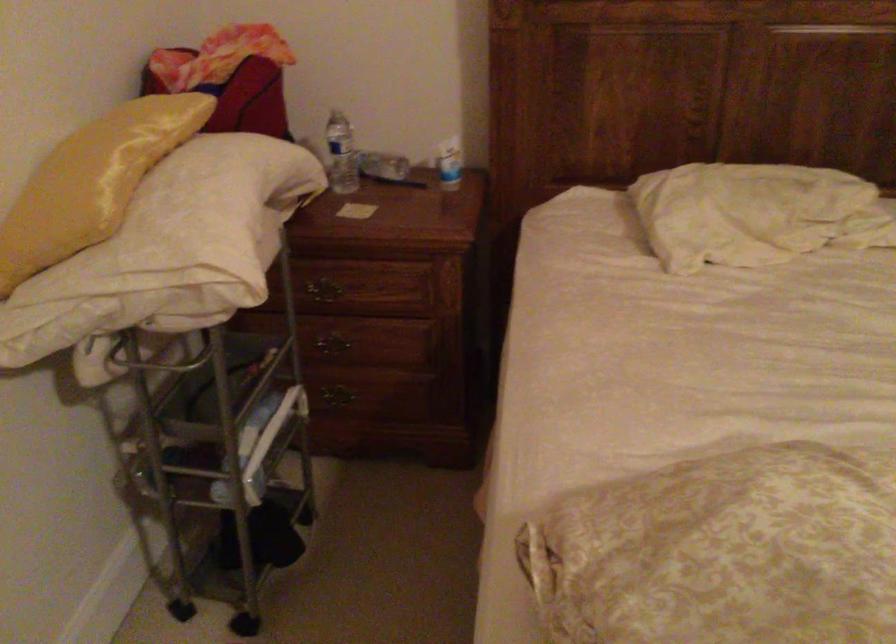
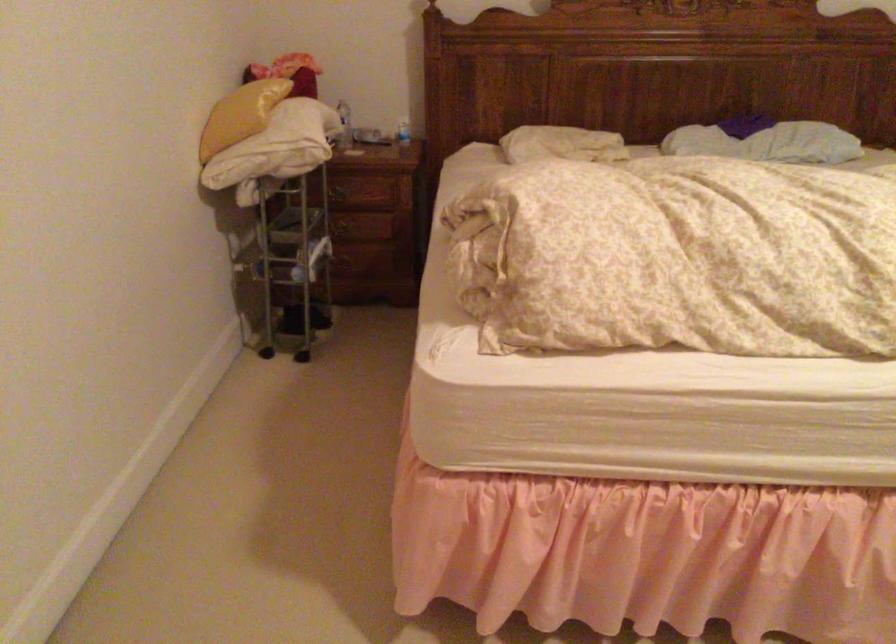
Where in the second image is the point corresponding to [320,181] from the first image?

(343, 125)